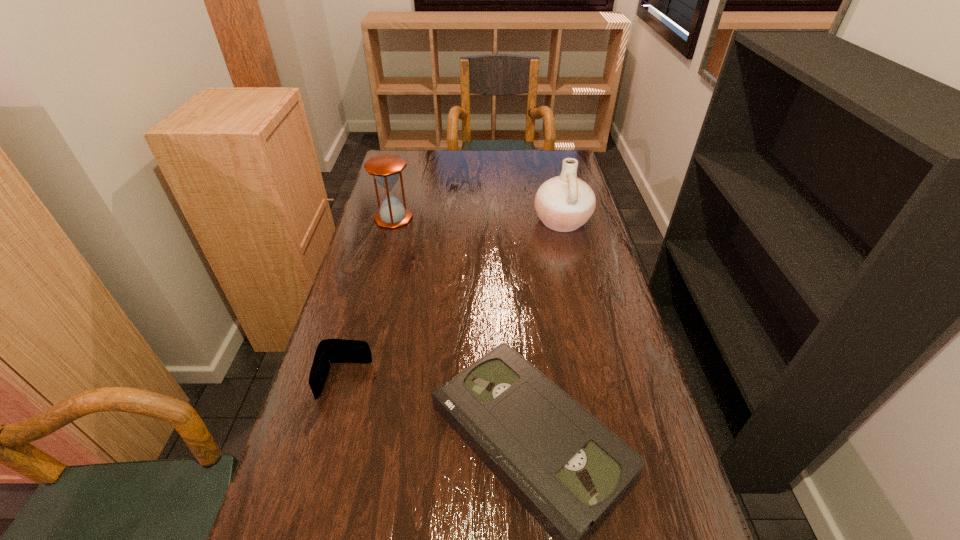
Image resolution: width=960 pixels, height=540 pixels. Identify the location of object at the right edge. (564, 203).

Locate an element on the screen. The width and height of the screenshot is (960, 540). vacant area at the far edge of the desktop is located at coordinates (513, 158).

Where is `vacant area at the right edge`? vacant area at the right edge is located at coordinates (564, 282).

The width and height of the screenshot is (960, 540). What are the coordinates of `free spot between the second shortest object and the pottery` in the screenshot? It's located at (454, 301).

Where is `empty space that is in between the hourglass and the pottery`? This screenshot has height=540, width=960. empty space that is in between the hourglass and the pottery is located at coordinates (478, 219).

Find the location of a particular element. The height and width of the screenshot is (540, 960). free space between the wallet and the hourglass is located at coordinates (370, 299).

This screenshot has height=540, width=960. I want to click on unoccupied area between the hourglass and the wallet, so click(370, 299).

Locate an element on the screen. This screenshot has height=540, width=960. vacant point located between the hourglass and the wallet is located at coordinates (370, 299).

The image size is (960, 540). In order to click on vacant area that lies between the pottery and the third tallest object in this screenshot , I will do `click(454, 301)`.

I want to click on object that is the closest one to the pottery, so click(386, 169).